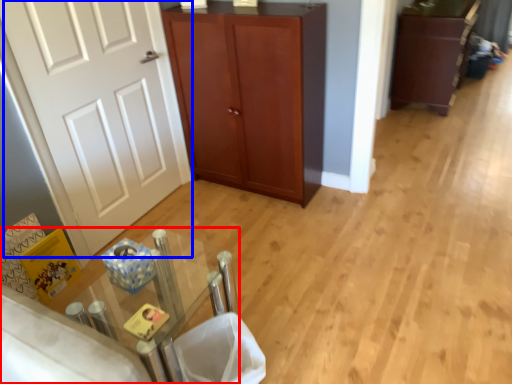
Question: Which of the following is the farthest to the observer, table (highlighted by a red box) or door (highlighted by a blue box)?

Choices:
 (A) table
 (B) door

Answer: (B)